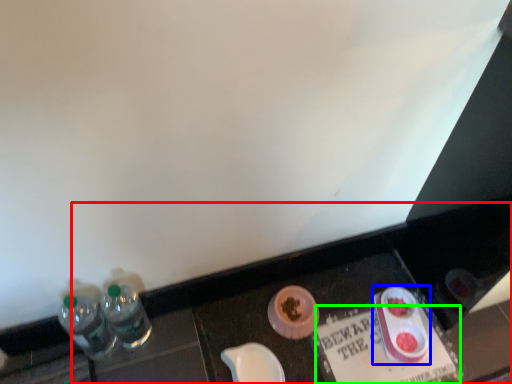
Question: Based on their relative distances, which object is farther from vanity (highlighted by a red box)? Choose from tableware (highlighted by a blue box) and writing (highlighted by a green box).

Choices:
 (A) tableware
 (B) writing

Answer: (A)